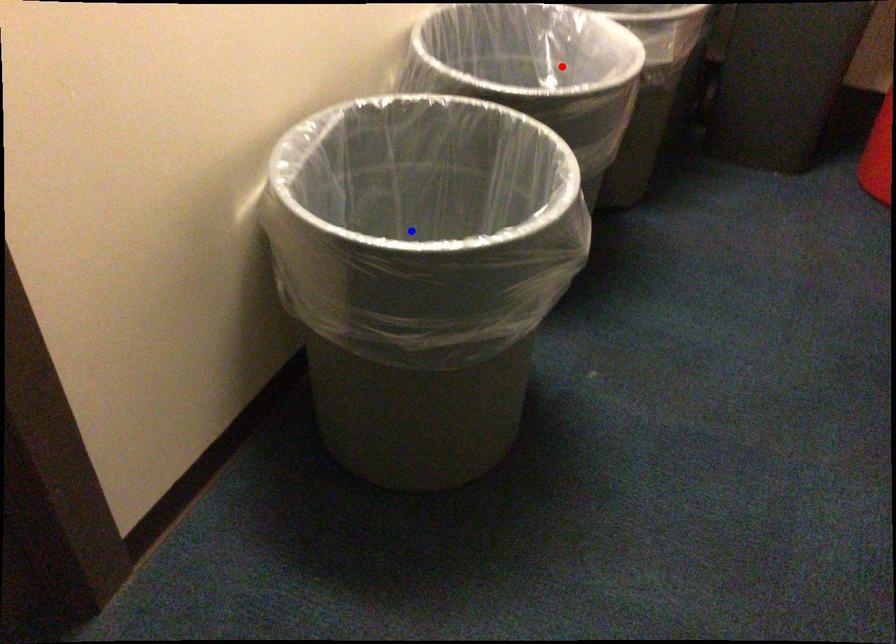
Question: Two points are marked on the image. Which point is closer to the camera?

Choices:
 (A) Blue point is closer.
 (B) Red point is closer.

Answer: (A)